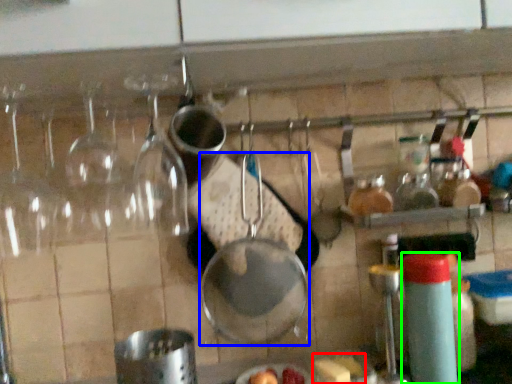
Question: Based on their relative distances, which object is farther from food (highlighted by a red box)? Choose from frying pan (highlighted by a blue box) and bottle (highlighted by a green box).

Choices:
 (A) frying pan
 (B) bottle

Answer: (A)